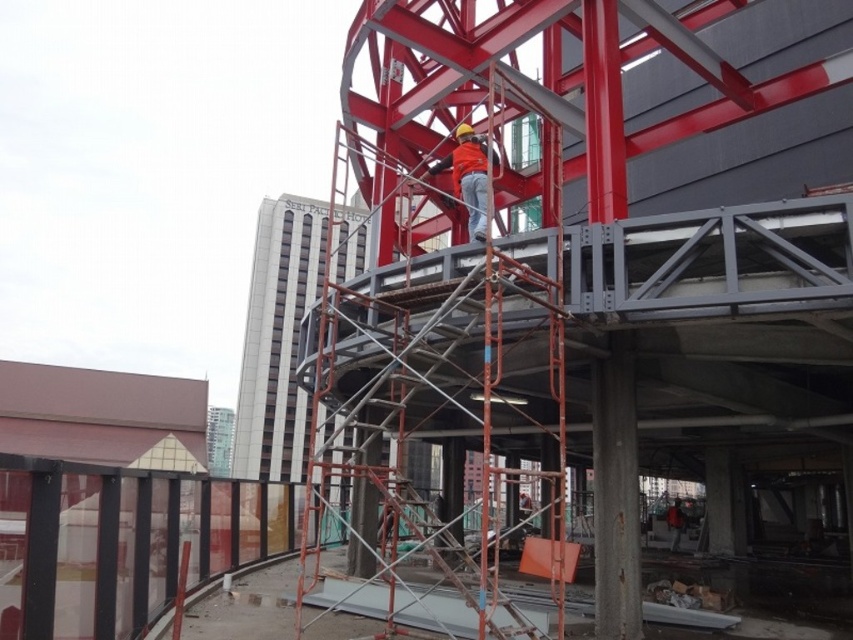
You are a safety inspector evaluating the construction site. You notice the metal scaffolding at center and the orange fabric construction worker at center. Based on their widths, which one is wider?

The metal scaffolding at center is wider than the orange fabric construction worker at center.

You are a safety inspector at a construction site. You need to ensure that the orange fabric construction worker at center maintains a safe distance from the metal scaffolding at center. According to safety regulations, workers must stay at least 5 meters away from scaffolding to avoid collision risks. Is the current distance compliant with the regulation?

The distance between the metal scaffolding at center and the orange fabric construction worker at center is 6.23 meters, which exceeds the required 5 meters safety distance. Therefore, the current setup complies with the safety regulations.

You are a safety inspector at the construction site. You need to check the distance between the metal scaffolding at center and the orange fabric construction worker at center. According to the description, which one is closer to you?

The metal scaffolding at center is closer to the viewer than the orange fabric construction worker at center, so the scaffolding is closer.